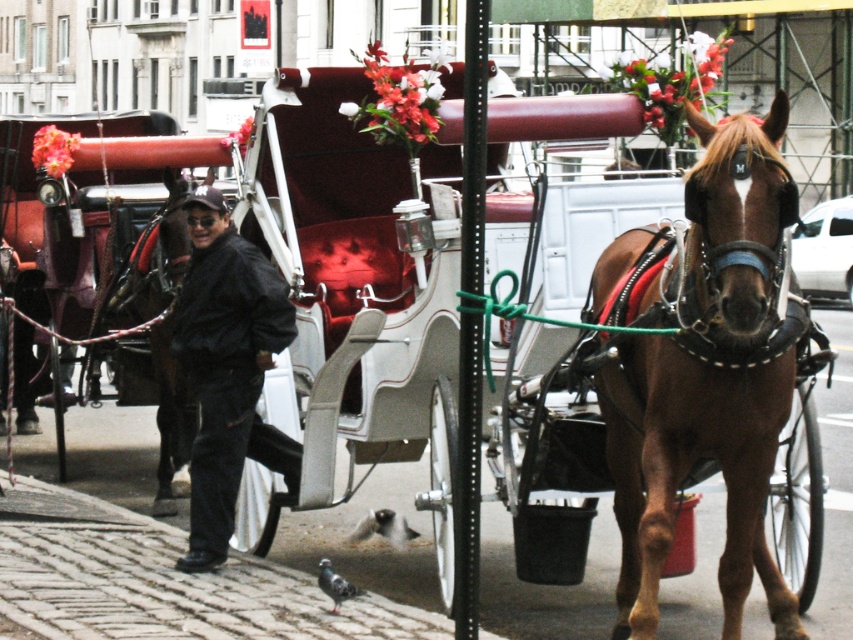
Measure the distance between gray matte pigeon at lower center and camera.

A distance of 11.04 meters exists between gray matte pigeon at lower center and camera.

You are a GUI agent. You are given a task and a screenshot of the screen. Output one action in this format:
    pyautogui.click(x=<x>, y=<y>)
    Task: Click on the gray matte pigeon at lower center
    Image resolution: width=853 pixels, height=640 pixels.
    Given the screenshot: What is the action you would take?
    pyautogui.click(x=383, y=528)

Between brown glossy horse at center and gray speckled pigeon at lower center, which one appears on the right side from the viewer's perspective?

brown glossy horse at center

Based on the photo, is brown glossy horse at center wider than gray speckled pigeon at lower center?

Correct, the width of brown glossy horse at center exceeds that of gray speckled pigeon at lower center.

Is point (647, 460) positioned in front of point (332, 582)?

Yes, point (647, 460) is closer to viewer.

Find the location of a particular element. This screenshot has height=640, width=853. brown glossy horse at center is located at coordinates (704, 369).

Can you confirm if brown glossy horse at center is positioned to the left of black matte jacket at center?

In fact, brown glossy horse at center is to the right of black matte jacket at center.

Measure the distance between point (660, 234) and camera.

Point (660, 234) is 8.42 meters from camera.

What do you see at coordinates (704, 369) in the screenshot?
I see `brown glossy horse at center` at bounding box center [704, 369].

Identify the location of brown glossy horse at center. (704, 369).